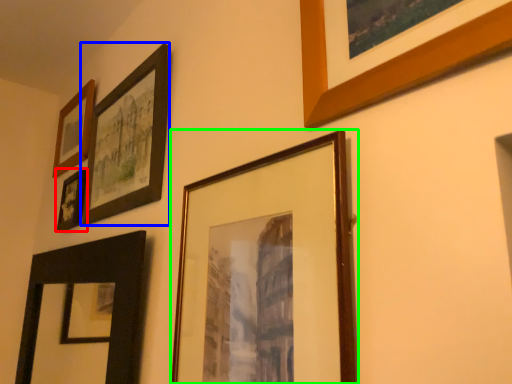
Question: Which object is positioned closest to picture frame (highlighted by a red box)? Select from picture frame (highlighted by a blue box) and picture frame (highlighted by a green box).

Choices:
 (A) picture frame
 (B) picture frame

Answer: (A)